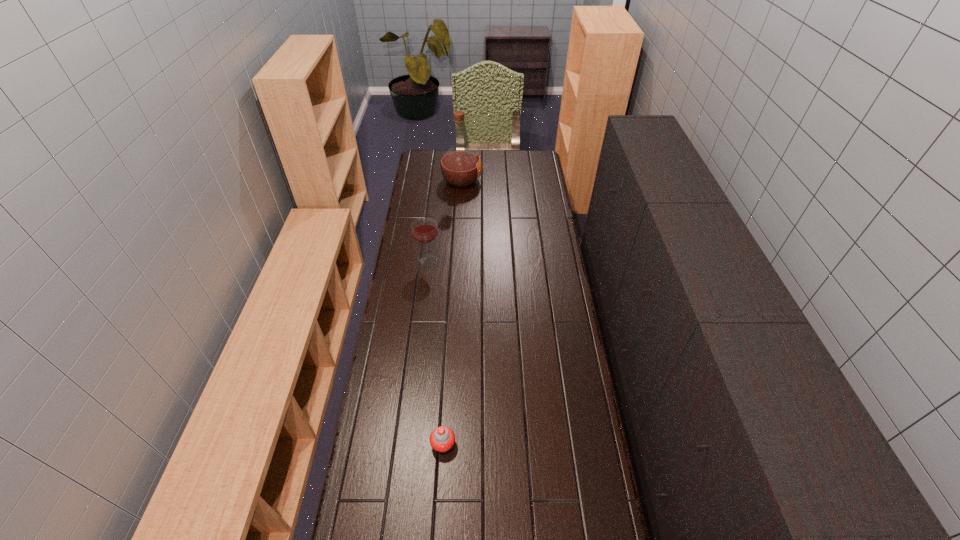
Image resolution: width=960 pixels, height=540 pixels. I want to click on liquor at the left edge, so tap(460, 166).

You are a GUI agent. You are given a task and a screenshot of the screen. Output one action in this format:
    pyautogui.click(x=<x>, y=<y>)
    Task: Click on the wineglass that is at the left edge
    
    Given the screenshot: What is the action you would take?
    pyautogui.click(x=424, y=230)

In order to click on object that is positioned at the far left corner in this screenshot , I will do `click(460, 166)`.

Where is `vacant space at the left edge of the desktop`? The width and height of the screenshot is (960, 540). vacant space at the left edge of the desktop is located at coordinates (403, 536).

Where is `vacant space at the right edge of the desktop`? This screenshot has height=540, width=960. vacant space at the right edge of the desktop is located at coordinates (583, 369).

This screenshot has height=540, width=960. I want to click on free space at the far left corner, so click(x=439, y=158).

The image size is (960, 540). In the image, there is a desktop. Identify the location of vacant space at the far right corner. (524, 170).

What are the coordinates of `vacant area that lies between the second farthest object and the cupcake` in the screenshot? It's located at (436, 352).

What are the coordinates of `free space between the shortest object and the second farthest object` in the screenshot? It's located at pyautogui.click(x=436, y=352).

The width and height of the screenshot is (960, 540). I want to click on blank region between the tallest object and the nearest object, so click(452, 312).